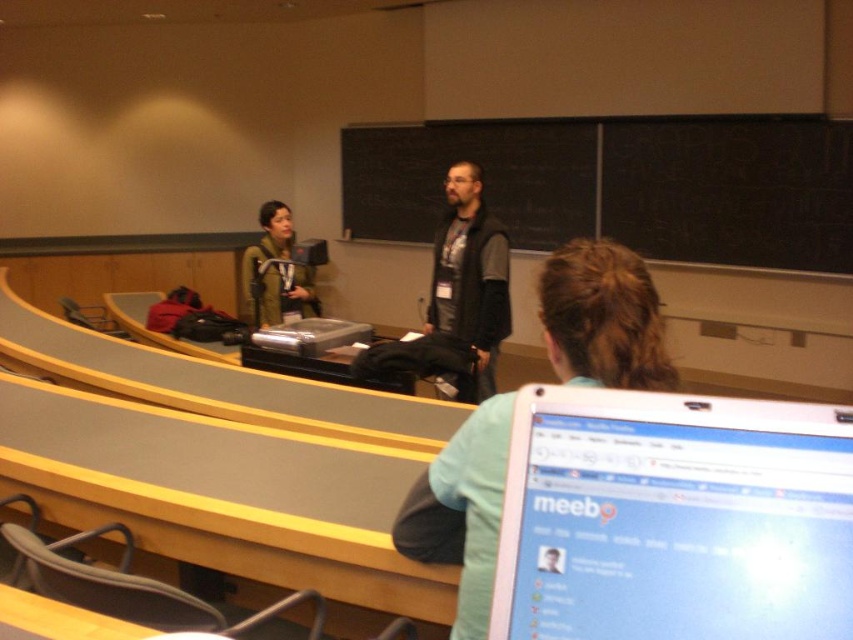
You are an observer in the classroom. You see the dark gray jacket at center and the dark gray vest at center. Which one is closer to the floor?

The dark gray jacket at center is positioned under the dark gray vest at center, so the dark gray jacket at center is closer to the floor.

Based on the photo, you are standing at the point labeled as point (537, 445) in the classroom. If you want to move to the desk where the laptop is placed, which direction should you move in to reach it?

Since the desk with the laptop is located in the midground and the point (537, 445) is part of the foreground, you should move forward towards the midground to reach the desk where the laptop is placed.